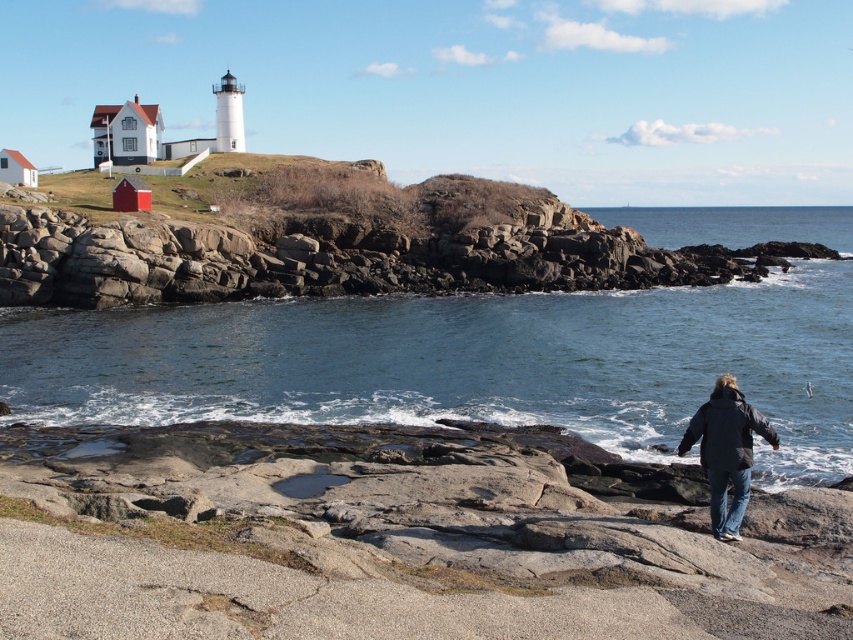
Consider the image. Does clear blue water at center have a larger size compared to rocky at upper left?

Yes.

Can you confirm if clear blue water at center is positioned to the right of rocky at upper left?

Yes, clear blue water at center is to the right of rocky at upper left.

Is point (547, 300) positioned before point (624, 241)?

Yes, it is in front of point (624, 241).

What are the coordinates of `clear blue water at center` in the screenshot? It's located at (463, 362).

Which of these two, clear blue water at center or dark blue jacket at lower right, stands taller?

Standing taller between the two is clear blue water at center.

From the picture: Can you confirm if clear blue water at center is wider than dark blue jacket at lower right?

Indeed, clear blue water at center has a greater width compared to dark blue jacket at lower right.

You are a GUI agent. You are given a task and a screenshot of the screen. Output one action in this format:
    pyautogui.click(x=<x>, y=<y>)
    Task: Click on the clear blue water at center
    This screenshot has height=640, width=853.
    Given the screenshot: What is the action you would take?
    pyautogui.click(x=463, y=362)

Between rocky at upper left and dark blue jacket at lower right, which one has more height?

rocky at upper left

Is rocky at upper left closer to camera compared to dark blue jacket at lower right?

That is False.

This screenshot has height=640, width=853. I want to click on rocky at upper left, so click(345, 259).

Locate an element on the screen. rocky at upper left is located at coordinates (345, 259).